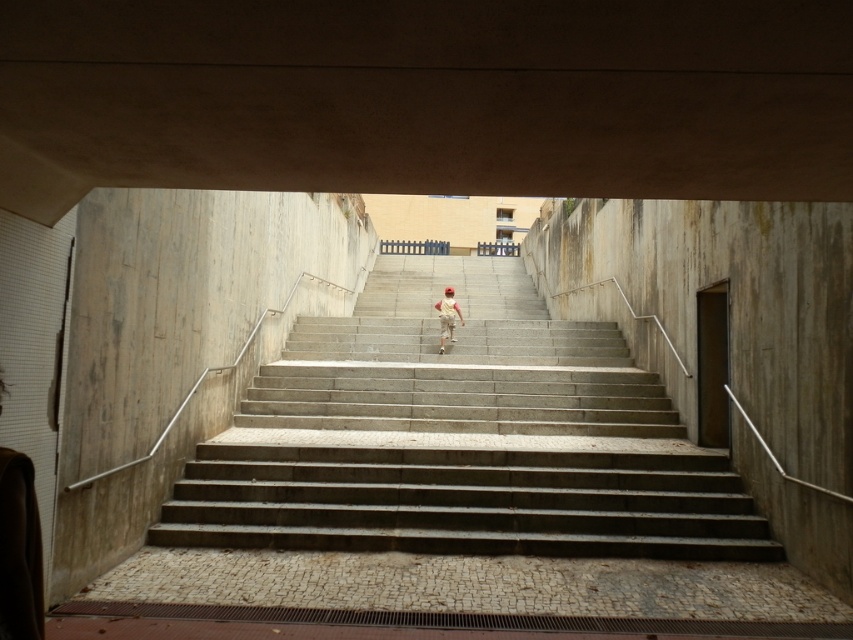
You are standing at the bottom of the staircase and want to reach the top. There are two points marked on the staircase, point 1 at coordinates point (444, 280) and point 2 at coordinates point (444, 307). Which point is closer to you as you climb the stairs?

Point (444, 280) is closer to you than point (444, 307) because it is further to the viewer, meaning it is positioned nearer to your current position at the bottom of the staircase.

You are standing at the bottom of the concrete stairs at center and want to climb them while wearing light beige fabric pants at center. Will the length of the pants be sufficient to cover your knees when you climb?

The concrete stairs at center is much taller than the light beige fabric pants at center, so the pants may not be long enough to cover your knees when climbing the stairs.